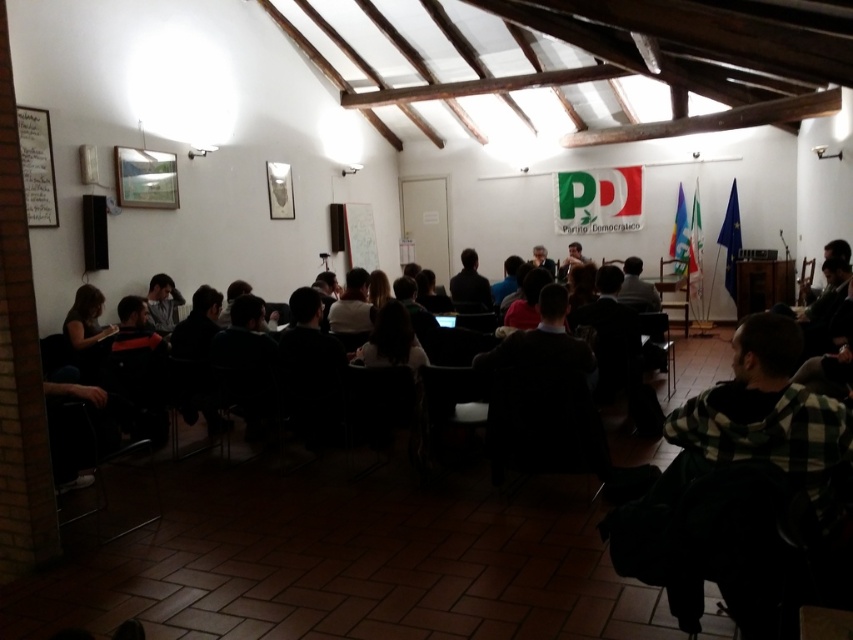
You are standing in the meeting room and want to determine which of the two points, point (x=457, y=273) or point (x=151, y=278), is closer to you. Based on the coordinates provided, can you tell which point is nearer?

Point (x=151, y=278) is closer to you because it has a smaller y coordinate, meaning it is positioned lower on the image plane, which in this context corresponds to being physically closer to the observer in the room.